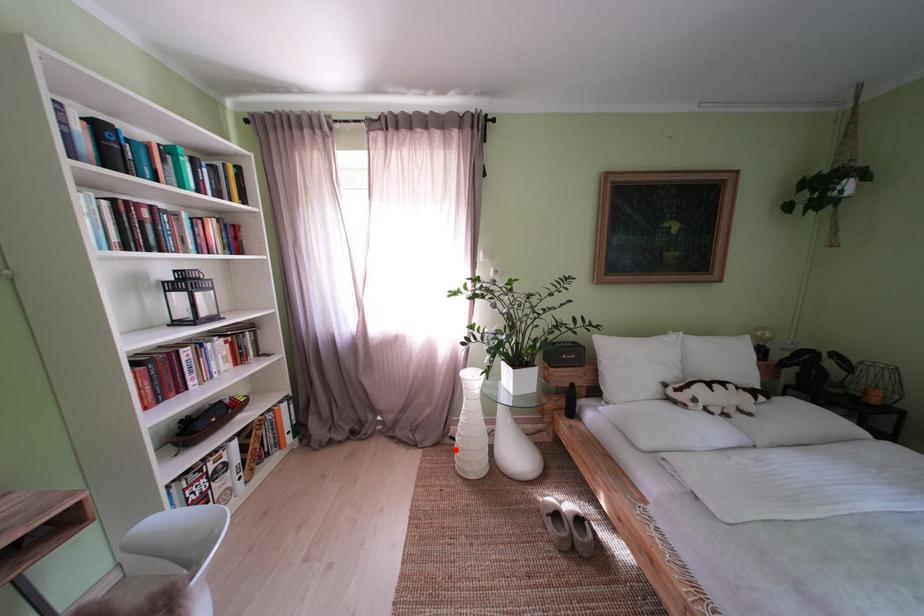
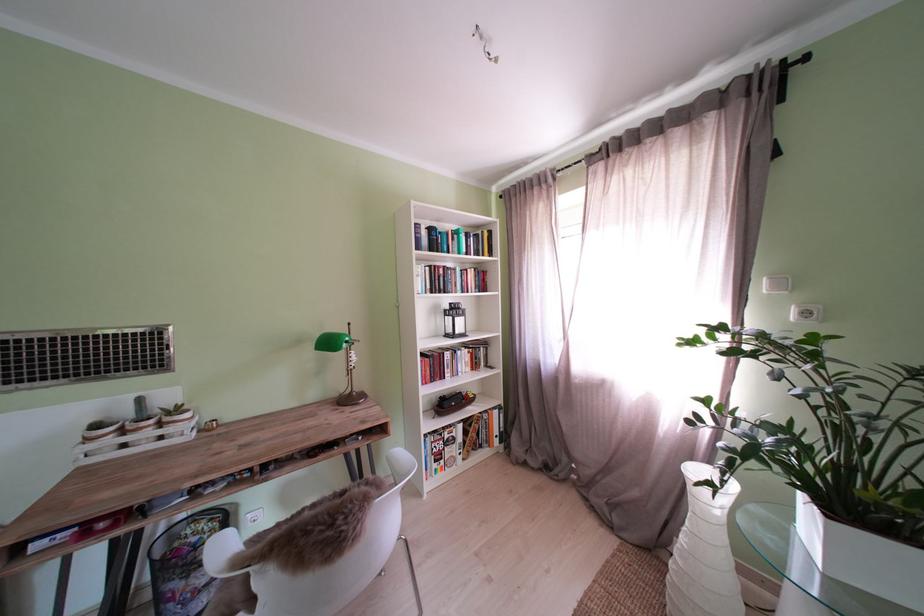
Question: I am providing you with two images of the same scene from different viewpoints. Given a red point in image1, look at the same physical point in image2. Is it:

Choices:
 (A) Closer to the viewpoint
 (B) Farther from the viewpoint

Answer: (B)